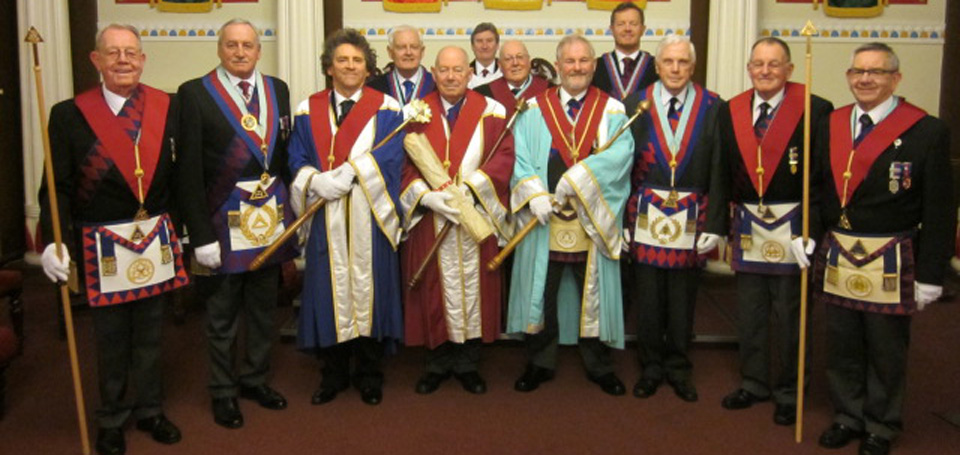
The image size is (960, 455). I want to click on floor, so click(x=546, y=422).